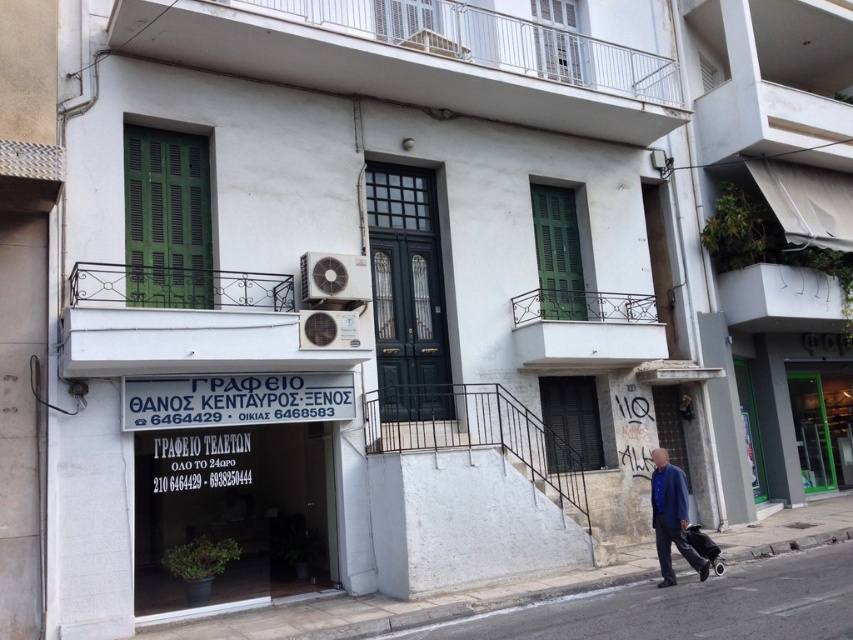
Does gray concrete pavement at lower center have a lesser width compared to blue denim jacket at lower right?

Incorrect, gray concrete pavement at lower center's width is not less than blue denim jacket at lower right's.

This screenshot has height=640, width=853. Find the location of `gray concrete pavement at lower center`. gray concrete pavement at lower center is located at coordinates (685, 605).